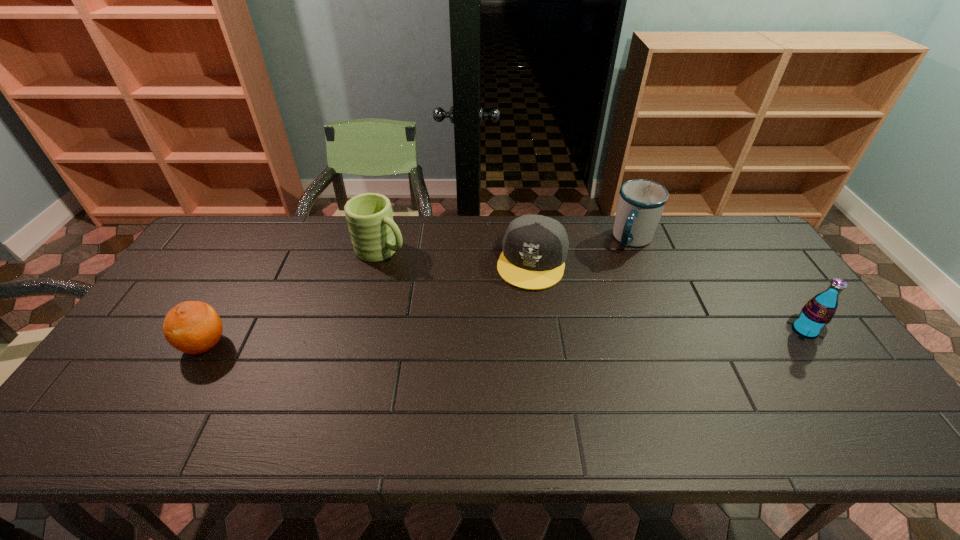
This screenshot has height=540, width=960. In the image, there is a desktop. Find the location of `free space at the near edge`. free space at the near edge is located at coordinates (193, 400).

Identify the location of vacant area at the left edge of the desktop. (164, 366).

Identify the location of vacant space at the right edge of the desktop. Image resolution: width=960 pixels, height=540 pixels. (751, 266).

You are a GUI agent. You are given a task and a screenshot of the screen. Output one action in this format:
    pyautogui.click(x=<x>, y=<y>)
    Task: Click on the vacant space at the near left corner
    
    Given the screenshot: What is the action you would take?
    pyautogui.click(x=137, y=386)

In order to click on vacant space at the far right corner in this screenshot , I will do `click(745, 256)`.

In order to click on free spot between the orange and the cap in this screenshot , I will do `click(369, 302)`.

Where is `unoccupied position between the soda and the right mug`? unoccupied position between the soda and the right mug is located at coordinates (719, 285).

At what (x,y) coordinates should I click in order to perform the action: click on free space between the soda and the cap. Please return your answer as a coordinate pair (x, y). Looking at the image, I should click on (669, 295).

Find the location of `unoccupied position between the third object from right to left and the right mug`. unoccupied position between the third object from right to left and the right mug is located at coordinates (583, 250).

Where is `empty space between the cap and the left mug`? empty space between the cap and the left mug is located at coordinates (457, 255).